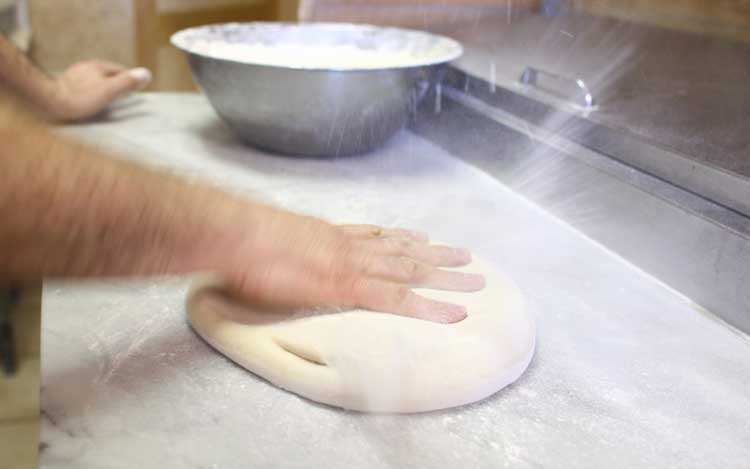
At what (x,y) coordinates should I click in order to perform the action: click on counter. Please return your answer as a coordinate pair (x, y). The height and width of the screenshot is (469, 750). Looking at the image, I should click on (676, 350).